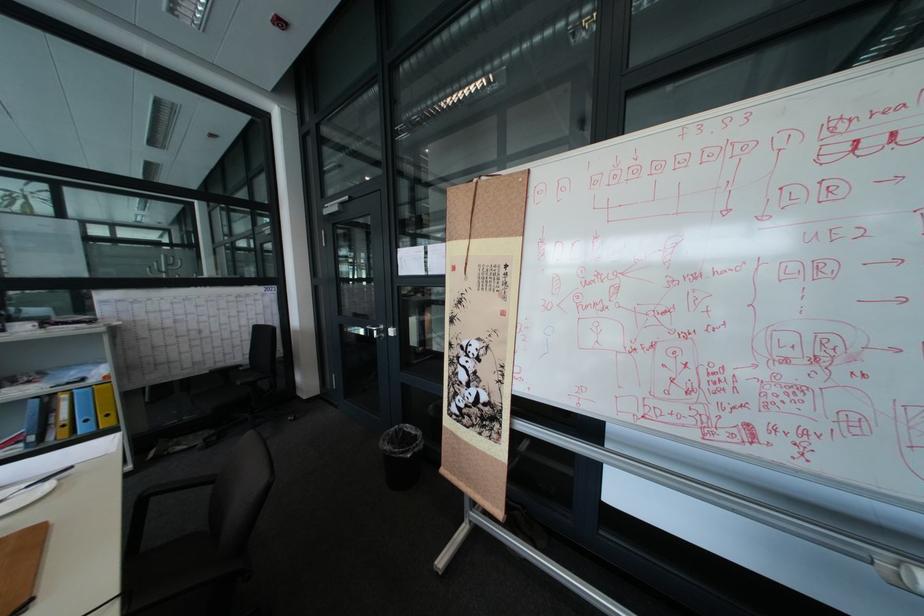
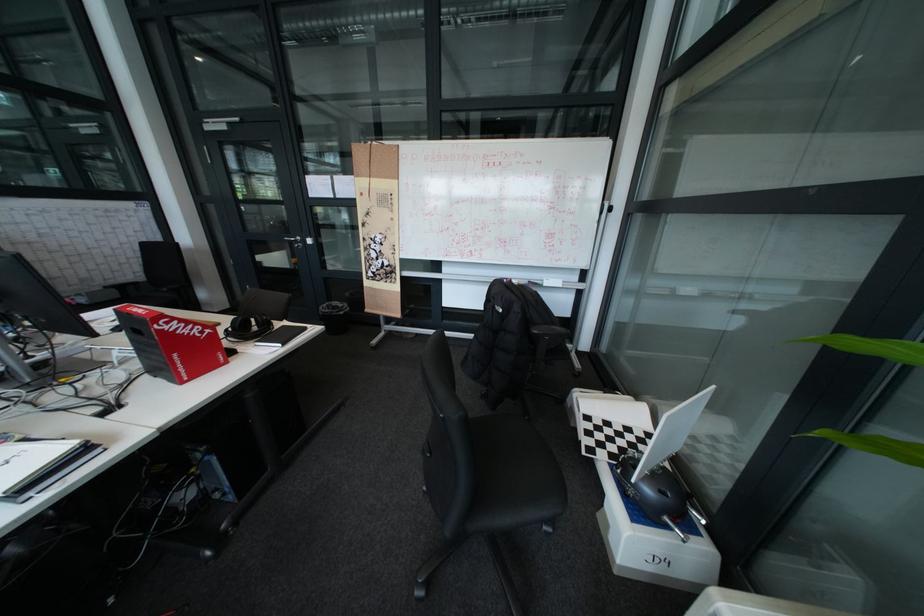
In the second image, find the point that corresponds to pixel 409 427 in the first image.

(341, 304)